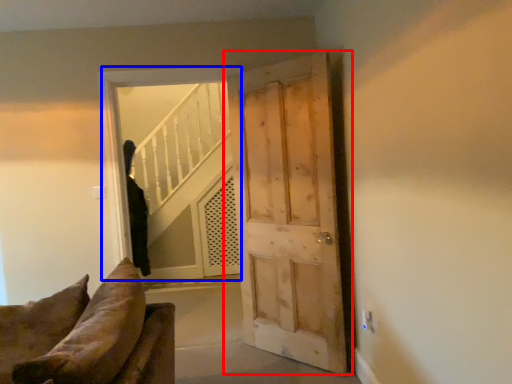
Question: Which object appears farthest to the camera in this image, door (highlighted by a red box) or window (highlighted by a blue box)?

Choices:
 (A) door
 (B) window

Answer: (B)